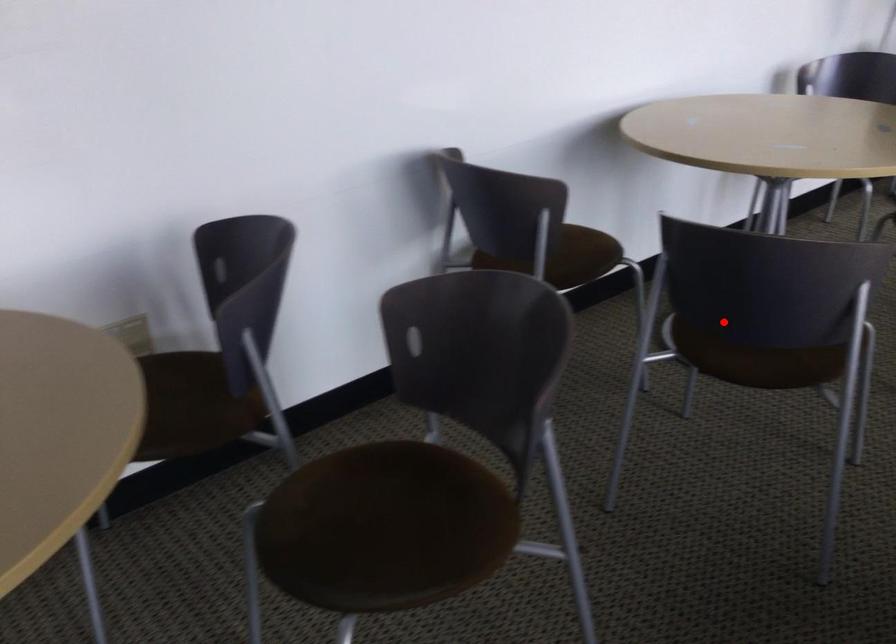
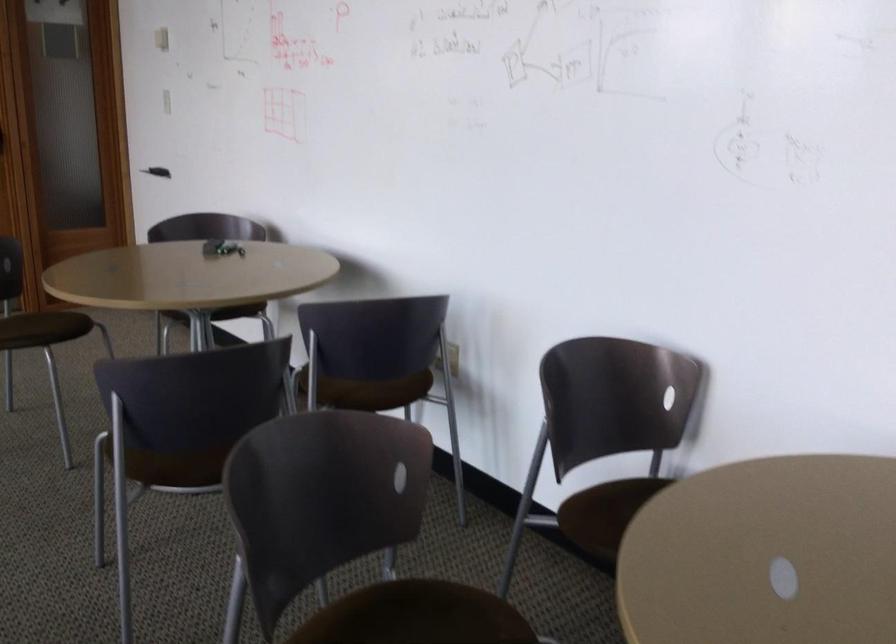
In the second image, find the point that corresponds to the highlighted location in the first image.

(418, 612)